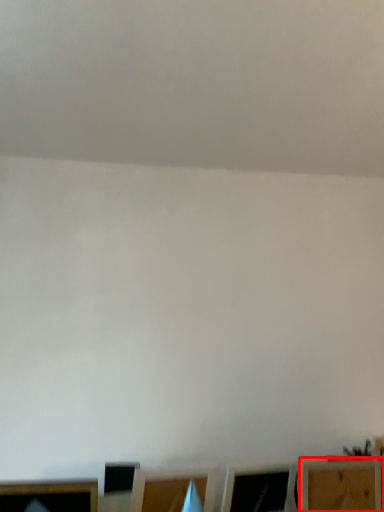
Question: From the image's perspective, where is furniture (annotated by the red box) located relative to furniture?

Choices:
 (A) below
 (B) above

Answer: (A)